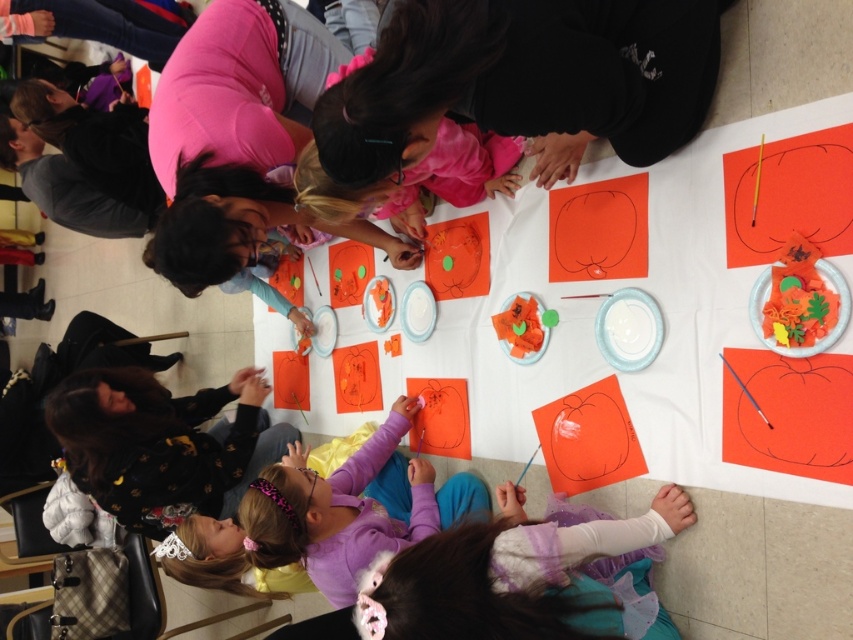
Question: Which point is closer to the camera?

Choices:
 (A) (653, 358)
 (B) (425, 314)
 (C) (749, 317)
 (D) (111, 385)

Answer: (C)

Question: Which object is closer to the camera taking this photo?

Choices:
 (A) purple fleece sweater at lower center
 (B) white glossy paper plate at center

Answer: (B)

Question: Can you confirm if orange paper plate at upper right is positioned to the right of white paper plate at center?

Choices:
 (A) yes
 (B) no

Answer: (A)

Question: Which point is closer to the camera taking this photo?

Choices:
 (A) (131, 518)
 (B) (756, 317)

Answer: (B)

Question: In this image, where is purple fleece sweater at lower center located relative to orange paper plate at upper right?

Choices:
 (A) below
 (B) above

Answer: (A)

Question: Where is purple fleece sweater at lower center located in relation to white paper plate at center in the image?

Choices:
 (A) above
 (B) below

Answer: (B)